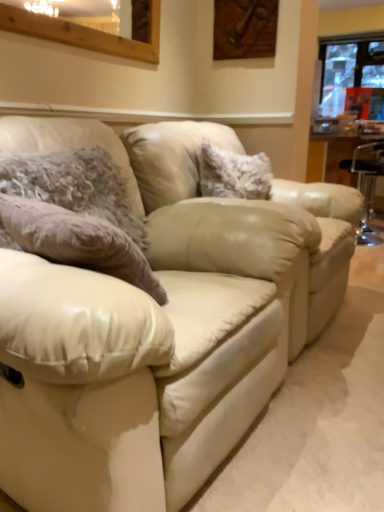
Where is `fuzzy fabric pillow at center, which is counted as the second pillow, starting from the front`? The image size is (384, 512). fuzzy fabric pillow at center, which is counted as the second pillow, starting from the front is located at coordinates (234, 174).

Measure the distance between transparent plastic bar stool at right and camera.

The depth of transparent plastic bar stool at right is 3.39 meters.

What do you see at coordinates (77, 241) in the screenshot? I see `fuzzy fabric pillow at left, placed as the second pillow when sorted from right to left` at bounding box center [77, 241].

Where is `fuzzy fabric pillow at left, placed as the second pillow when sorted from right to left`? The image size is (384, 512). fuzzy fabric pillow at left, placed as the second pillow when sorted from right to left is located at coordinates (77, 241).

In the scene shown: Measure the distance between point (185,248) and camera.

Point (185,248) is 4.70 feet from camera.

The width and height of the screenshot is (384, 512). What do you see at coordinates (249, 219) in the screenshot?
I see `beige leather swivel chair at center` at bounding box center [249, 219].

You are a GUI agent. You are given a task and a screenshot of the screen. Output one action in this format:
    pyautogui.click(x=<x>, y=<y>)
    Task: Click on the transparent glass window at upper right, which appears as the second window when viewed from the front
    This screenshot has width=384, height=512.
    Given the screenshot: What is the action you would take?
    pyautogui.click(x=349, y=67)

Identify the location of fuzzy fabric pillow at center, acting as the first pillow starting from the right. The height and width of the screenshot is (512, 384). (234, 174).

Visually, is beige leather swivel chair at center positioned to the left or to the right of wooden frame at upper left, the first window from the bottom?

In the image, beige leather swivel chair at center appears on the right side of wooden frame at upper left, the first window from the bottom.

Which object is more forward, beige leather swivel chair at center or wooden frame at upper left, positioned as the 1th window in left-to-right order?

wooden frame at upper left, positioned as the 1th window in left-to-right order, is in front.

Is beige leather swivel chair at center surrounding wooden frame at upper left, the first window from the bottom?

No, wooden frame at upper left, the first window from the bottom, is not inside beige leather swivel chair at center.

Considering the points (203, 177) and (335, 93), which point is behind, point (203, 177) or point (335, 93)?

The point (335, 93) is behind.

Considering the relative sizes of fuzzy fabric pillow at center, which appears as the 1th pillow when viewed from the back, and transparent glass window at upper right, marked as the first window in a back-to-front arrangement, in the image provided, is fuzzy fabric pillow at center, which appears as the 1th pillow when viewed from the back, wider than transparent glass window at upper right, marked as the first window in a back-to-front arrangement,?

Yes.

Measure the distance from fuzzy fabric pillow at center, acting as the first pillow starting from the right, to transparent glass window at upper right, the second window from the bottom.

fuzzy fabric pillow at center, acting as the first pillow starting from the right, and transparent glass window at upper right, the second window from the bottom, are 4.42 meters apart from each other.

Can you see fuzzy fabric pillow at center, acting as the first pillow starting from the right, touching transparent glass window at upper right, the second window when ordered from left to right?

No, fuzzy fabric pillow at center, acting as the first pillow starting from the right, is not making contact with transparent glass window at upper right, the second window when ordered from left to right.

Can you tell me how much beige leather swivel chair at center and transparent plastic bar stool at right differ in facing direction?

Answer: 179 degrees separate the facing orientations of beige leather swivel chair at center and transparent plastic bar stool at right.

From the image's perspective, between beige leather swivel chair at center and transparent plastic bar stool at right, who is located below?

beige leather swivel chair at center.

Find the location of a particular element. bar stool on the right of beige leather swivel chair at center is located at coordinates (366, 187).

Considering the relative positions of beige leather swivel chair at center and transparent plastic bar stool at right in the image provided, is beige leather swivel chair at center to the left of transparent plastic bar stool at right from the viewer's perspective?

Correct, you'll find beige leather swivel chair at center to the left of transparent plastic bar stool at right.

Is transparent glass window at upper right, the second window from the bottom, located outside wooden frame at upper left, positioned as the 1th window in left-to-right order?

Yes, transparent glass window at upper right, the second window from the bottom, is outside of wooden frame at upper left, positioned as the 1th window in left-to-right order.

Considering the sizes of transparent glass window at upper right, marked as the first window in a back-to-front arrangement, and wooden frame at upper left, the second window in the back-to-front sequence, in the image, is transparent glass window at upper right, marked as the first window in a back-to-front arrangement, wider or thinner than wooden frame at upper left, the second window in the back-to-front sequence,?

transparent glass window at upper right, marked as the first window in a back-to-front arrangement, is wider than wooden frame at upper left, the second window in the back-to-front sequence.

Is transparent glass window at upper right, the second window from the bottom, taller than wooden frame at upper left, which is counted as the 2th window, starting from the top?

Yes.

Is point (323, 105) positioned in front of point (153, 11)?

No, (323, 105) is behind (153, 11).

Between wooden frame at upper left, the second window in the back-to-front sequence, and transparent glass window at upper right, which is the first window in right-to-left order, which one is positioned in front?

wooden frame at upper left, the second window in the back-to-front sequence, is more forward.

Looking at this image, how far apart are wooden frame at upper left, the first window from the bottom, and transparent glass window at upper right, which is the first window in right-to-left order?

wooden frame at upper left, the first window from the bottom, is 4.57 meters away from transparent glass window at upper right, which is the first window in right-to-left order.

Between point (74, 26) and point (378, 40), which one is positioned behind?

Point (378, 40)

Can you confirm if wooden frame at upper left, the first window from the bottom, is shorter than matte cream leather couch at center?

Yes, wooden frame at upper left, the first window from the bottom, is shorter than matte cream leather couch at center.

In the scene shown: Does wooden frame at upper left, positioned as the 1th window in left-to-right order, appear on the right side of matte cream leather couch at center?

No.

In the scene shown: Considering the relative sizes of wooden frame at upper left, which is counted as the 2th window, starting from the top, and matte cream leather couch at center in the image provided, is wooden frame at upper left, which is counted as the 2th window, starting from the top, bigger than matte cream leather couch at center?

No.

Between point (365, 170) and point (32, 26), which one is positioned behind?

The point (365, 170) is behind.

Is transparent plastic bar stool at right far from wooden frame at upper left, which is counted as the 2th window, starting from the top?

Yes, transparent plastic bar stool at right and wooden frame at upper left, which is counted as the 2th window, starting from the top, are located far from each other.

Is transparent plastic bar stool at right positioned before wooden frame at upper left, the first window from the bottom?

No, transparent plastic bar stool at right is further to the viewer.

Identify the location of swivel chair that appears behind the wooden frame at upper left, the second window in the back-to-front sequence. The image size is (384, 512). 249,219.

From a real-world perspective, which pillow is the 1st one underneath the transparent glass window at upper right, the first window from the top? Please provide its 2D coordinates.

[(234, 174)]

Considering their positions, is transparent glass window at upper right, which appears as the second window when viewed from the front, positioned further to fuzzy fabric pillow at left, which appears as the first pillow when viewed from the left, than wooden frame at upper left, which is counted as the 2th window, starting from the top?

transparent glass window at upper right, which appears as the second window when viewed from the front, is further to fuzzy fabric pillow at left, which appears as the first pillow when viewed from the left.

Based on their spatial positions, is matte cream leather couch at center or wooden frame at upper left, positioned as the 1th window in left-to-right order, closer to transparent plastic bar stool at right?

matte cream leather couch at center is closer to transparent plastic bar stool at right.

Looking at the image, which one is located further to transparent plastic bar stool at right, transparent glass window at upper right, marked as the first window in a back-to-front arrangement, or wooden frame at upper left, which is counted as the 2th window, starting from the top?

Based on the image, transparent glass window at upper right, marked as the first window in a back-to-front arrangement, appears to be further to transparent plastic bar stool at right.

Considering their positions, is transparent plastic bar stool at right positioned further to beige leather swivel chair at center than wooden frame at upper left, which is counted as the 2th window, starting from the top?

The object further to beige leather swivel chair at center is transparent plastic bar stool at right.

Estimate the real-world distances between objects in this image. Which object is closer to transparent glass window at upper right, marked as the first window in a back-to-front arrangement, wooden frame at upper left, marked as the second window in a right-to-left arrangement, or fuzzy fabric pillow at center, which appears as the 1th pillow when viewed from the back?

Among the two, fuzzy fabric pillow at center, which appears as the 1th pillow when viewed from the back, is located nearer to transparent glass window at upper right, marked as the first window in a back-to-front arrangement.

Looking at this image, estimate the real-world distances between objects in this image. Which object is closer to fuzzy fabric pillow at left, arranged as the 1th pillow when viewed from the front, transparent glass window at upper right, which is the first window in right-to-left order, or beige leather swivel chair at center?

beige leather swivel chair at center is closer to fuzzy fabric pillow at left, arranged as the 1th pillow when viewed from the front.

Based on the photo, when comparing their distances from fuzzy fabric pillow at center, acting as the first pillow starting from the right, does matte cream leather couch at center or fuzzy fabric pillow at left, placed as the second pillow when sorted from right to left, seem closer?

matte cream leather couch at center is positioned closer to the anchor fuzzy fabric pillow at center, acting as the first pillow starting from the right.

Consider the image. When comparing their distances from wooden frame at upper left, the second window in the back-to-front sequence, does transparent glass window at upper right, which is the first window in right-to-left order, or beige leather swivel chair at center seem closer?

Among the two, beige leather swivel chair at center is located nearer to wooden frame at upper left, the second window in the back-to-front sequence.

The image size is (384, 512). I want to click on bar stool between fuzzy fabric pillow at left, arranged as the 1th pillow when viewed from the front, and transparent glass window at upper right, which appears as the second window when viewed from the front, along the z-axis, so click(x=366, y=187).

Find the location of `pillow between fuzzy fabric pillow at left, which appears as the first pillow when viewed from the left, and transparent plastic bar stool at right in the front-back direction`. pillow between fuzzy fabric pillow at left, which appears as the first pillow when viewed from the left, and transparent plastic bar stool at right in the front-back direction is located at coordinates tap(234, 174).

Identify the location of swivel chair between fuzzy fabric pillow at left, which is the 2th pillow from back to front, and fuzzy fabric pillow at center, acting as the first pillow starting from the right, along the z-axis. This screenshot has height=512, width=384. (249, 219).

Where is `swivel chair positioned between fuzzy fabric pillow at left, which is the 2th pillow from back to front, and transparent plastic bar stool at right from near to far`? Image resolution: width=384 pixels, height=512 pixels. swivel chair positioned between fuzzy fabric pillow at left, which is the 2th pillow from back to front, and transparent plastic bar stool at right from near to far is located at coordinates (249, 219).